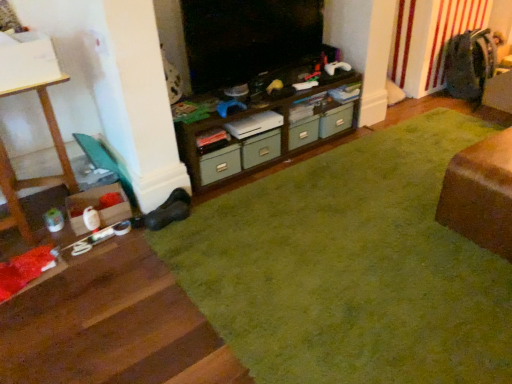
Where is `vacant area located to the right-hand side of green fabric drawer at center, arranged as the 2th drawer when viewed from the back`? vacant area located to the right-hand side of green fabric drawer at center, arranged as the 2th drawer when viewed from the back is located at coordinates pos(297,166).